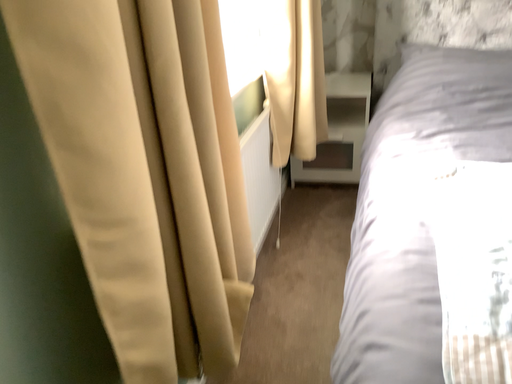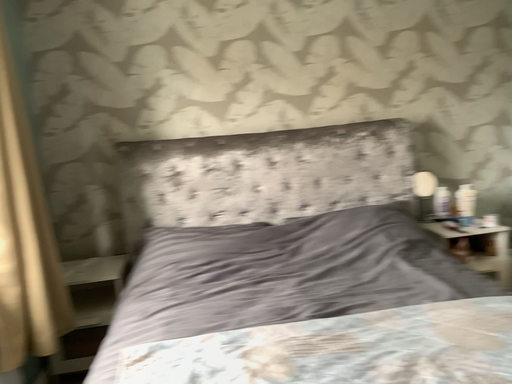
Question: How did the camera likely rotate when shooting the video?

Choices:
 (A) rotated downward
 (B) rotated upward

Answer: (B)